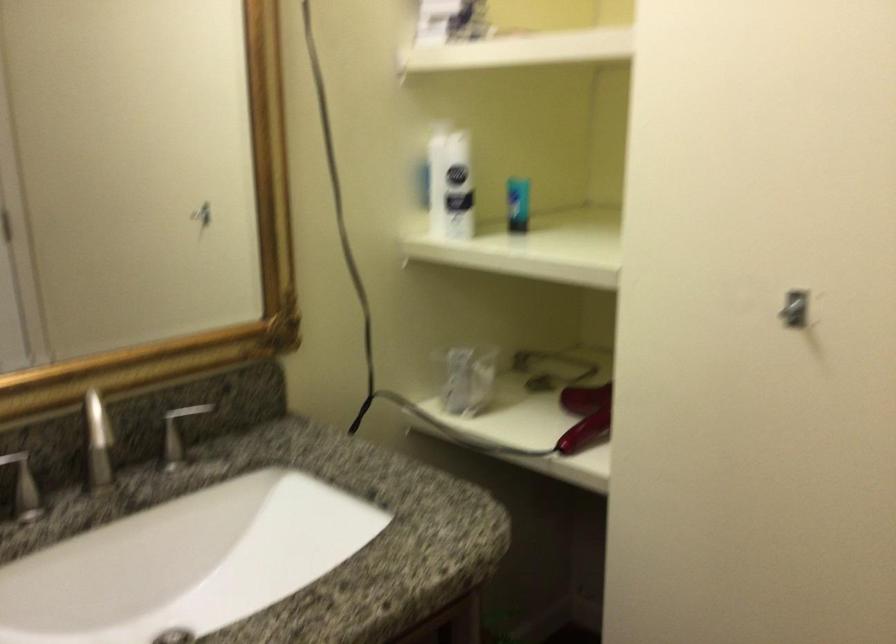
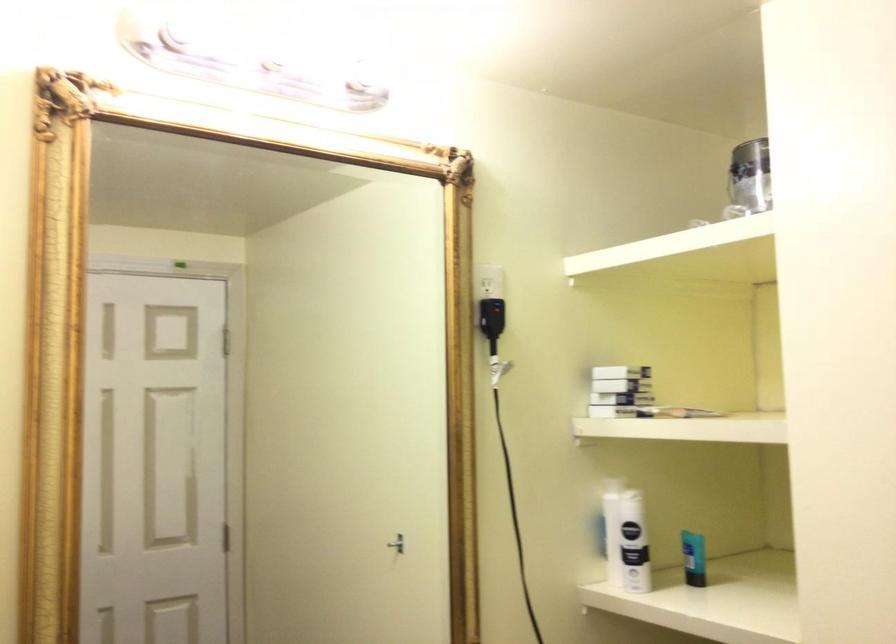
Question: I am providing you with two images of the same scene from different viewpoints. Which of the following objects are not visible in image2?

Choices:
 (A) silver paint can
 (B) small white box
 (C) white spray bottle
 (D) none of these

Answer: (D)